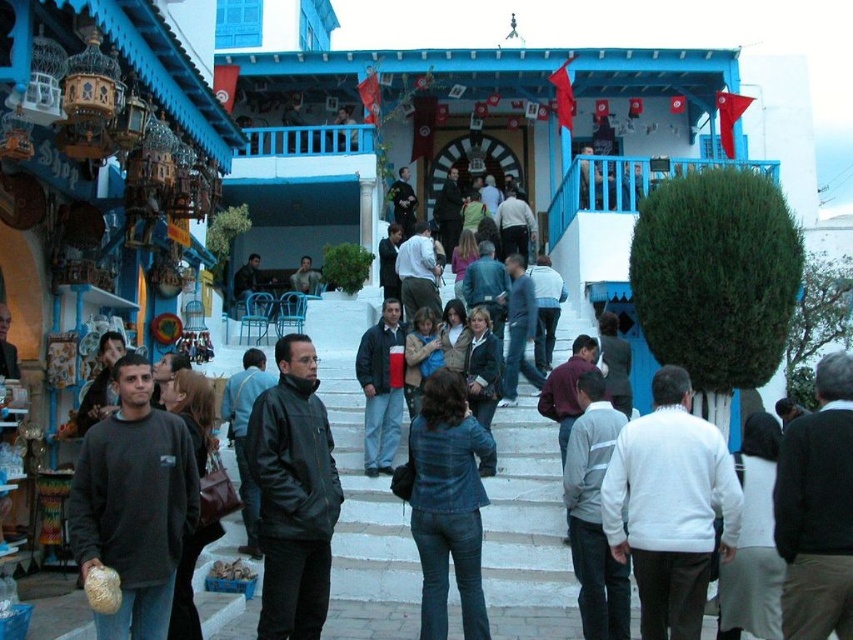
Question: Which object appears closest to the camera in this image?

Choices:
 (A) dark gray sweater at center
 (B) denim jacket at center
 (C) white matte sweater at center

Answer: (A)

Question: Which of the following is the closest to the observer?

Choices:
 (A) black leather jacket at center
 (B) dark gray sweater at center
 (C) white matte sweater at center

Answer: (B)

Question: Is black leather jacket at center in front of dark gray jacket at center?

Choices:
 (A) yes
 (B) no

Answer: (A)

Question: Does dark gray sweater at center come in front of denim jacket at center?

Choices:
 (A) no
 (B) yes

Answer: (B)

Question: Does white matte sweater at center appear under dark gray jacket at center?

Choices:
 (A) no
 (B) yes

Answer: (B)

Question: Which point is closer to the camera?

Choices:
 (A) dark gray jacket at center
 (B) white matte sweater at center
 (C) denim jacket at center

Answer: (B)